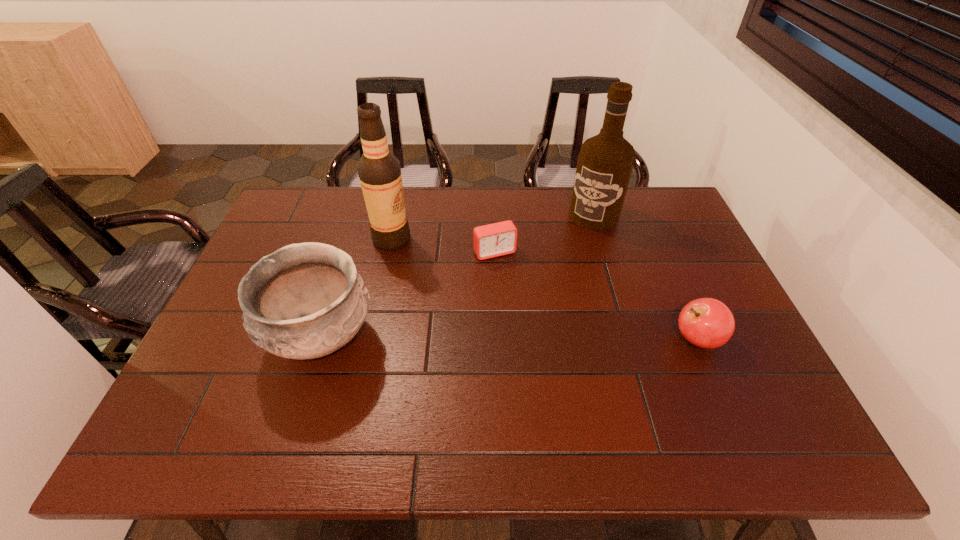
This screenshot has width=960, height=540. Find the location of `the third shortest object`. the third shortest object is located at coordinates (304, 301).

Where is `the rightmost object`? This screenshot has height=540, width=960. the rightmost object is located at coordinates (708, 323).

Locate an element on the screen. The width and height of the screenshot is (960, 540). the second shortest object is located at coordinates (708, 323).

Image resolution: width=960 pixels, height=540 pixels. I want to click on the right alcohol, so click(605, 163).

Identify the location of the left alcohol. (379, 171).

Locate an element on the screen. The image size is (960, 540). the third object from left to right is located at coordinates (497, 239).

This screenshot has width=960, height=540. What are the coordinates of `alarm clock` in the screenshot? It's located at (497, 239).

Locate an element on the screen. Image resolution: width=960 pixels, height=540 pixels. vacant space located 0.250m on the back of the pottery is located at coordinates (352, 239).

Where is `vacant space situated 0.210m on the left of the rightmost object`? This screenshot has width=960, height=540. vacant space situated 0.210m on the left of the rightmost object is located at coordinates (589, 339).

The image size is (960, 540). I want to click on free space located 0.280m on the label of the right alcohol, so click(x=547, y=281).